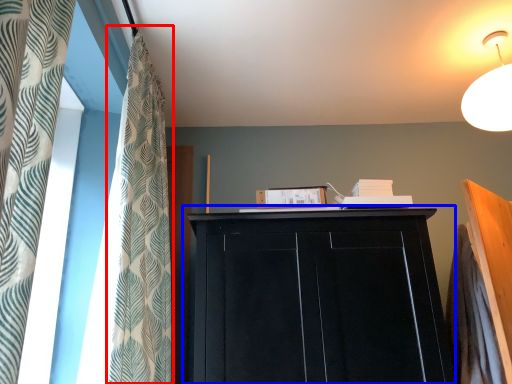
Question: Among these objects, which one is farthest to the camera, shower curtain (highlighted by a red box) or cupboard (highlighted by a blue box)?

Choices:
 (A) shower curtain
 (B) cupboard

Answer: (B)